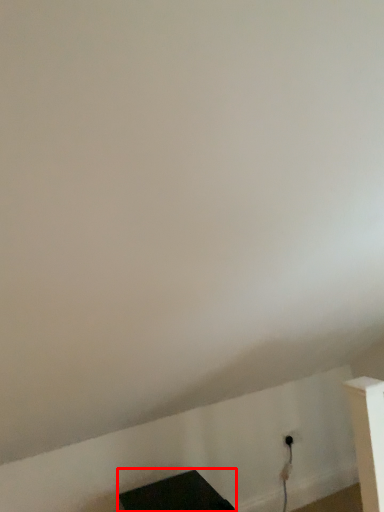
Question: From the image's perspective, where is furniture (annotated by the red box) located in relation to electric outlet in the image?

Choices:
 (A) below
 (B) above

Answer: (A)